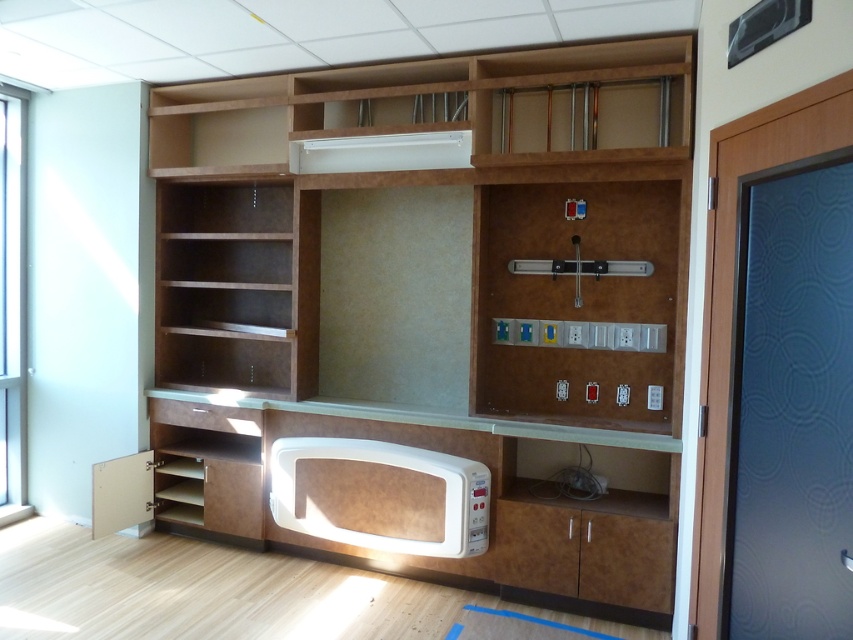
Question: Is burlwood cabinet at center to the right of wooden panel control panel at center from the viewer's perspective?

Choices:
 (A) yes
 (B) no

Answer: (B)

Question: Considering the relative positions of burlwood cabinet at center and wooden panel control panel at center in the image provided, where is burlwood cabinet at center located with respect to wooden panel control panel at center?

Choices:
 (A) below
 (B) above

Answer: (A)

Question: Which of these objects is positioned farthest from the burlwood cabinet at center?

Choices:
 (A) white matte microwave at lower center
 (B) wooden panel control panel at center

Answer: (A)

Question: Can you confirm if burlwood cabinet at center is positioned to the left of white matte microwave at lower center?

Choices:
 (A) no
 (B) yes

Answer: (A)

Question: Which of the following is the closest to the observer?

Choices:
 (A) (546, 252)
 (B) (346, 241)

Answer: (A)

Question: Which object is positioned farthest from the burlwood cabinet at center?

Choices:
 (A) white matte microwave at lower center
 (B) wooden panel control panel at center

Answer: (A)